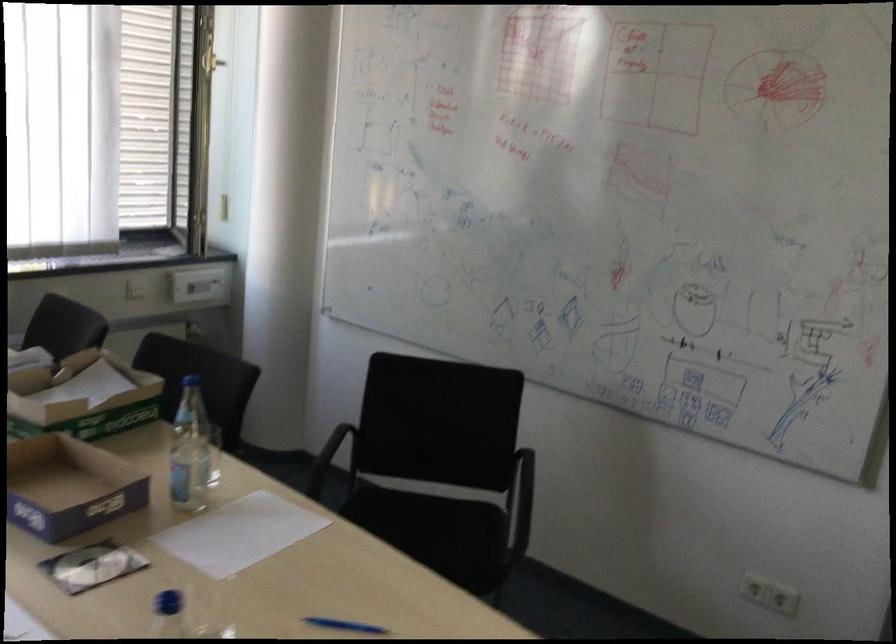
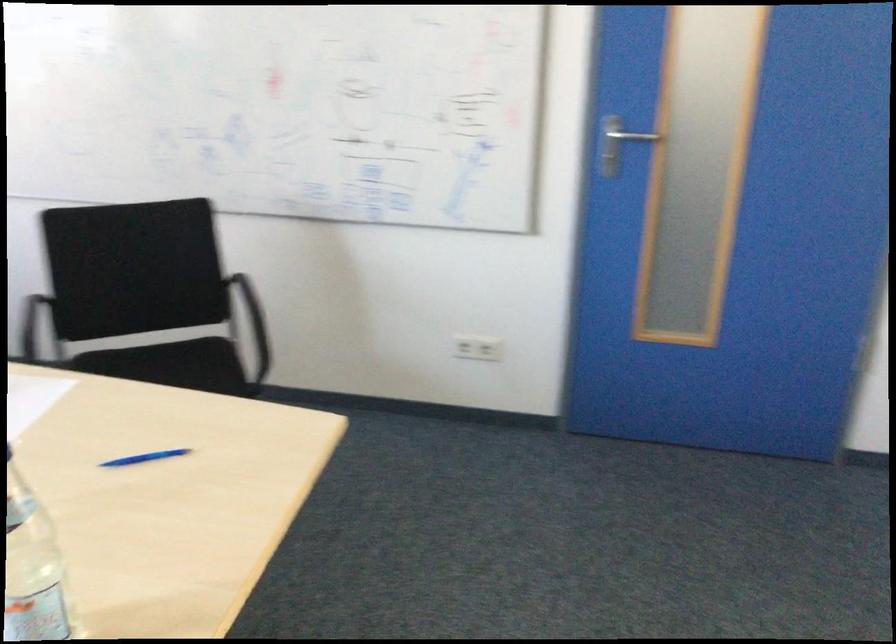
What movement of the cameraman would produce the second image?

The cameraman moved toward left, backward.